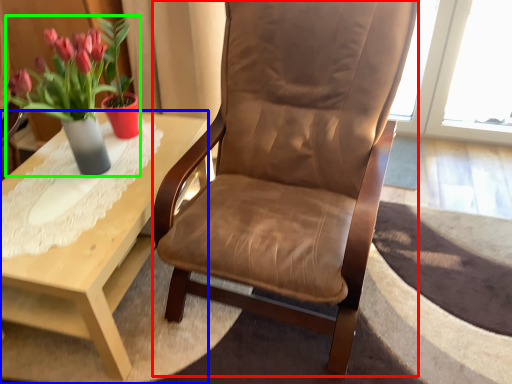
Question: Which object is the closest to the chair (highlighted by a red box)? Choose among these: coffee table (highlighted by a blue box) or houseplant (highlighted by a green box).

Choices:
 (A) coffee table
 (B) houseplant

Answer: (A)